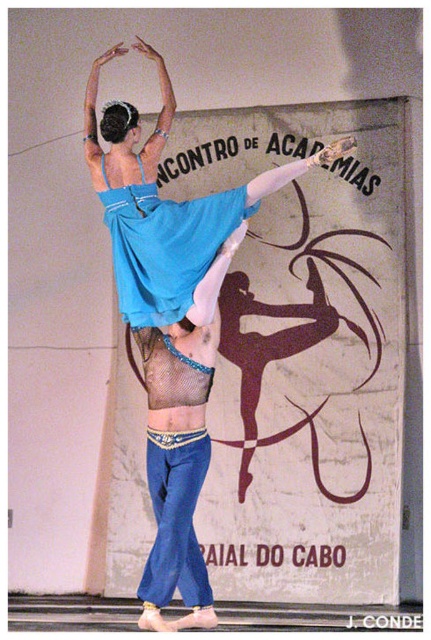
Based on the ballet performance scene described, where the two dancers are performing a lift with the female dancer in a flowing blue dress, can you identify the object located at the coordinates point (x=165, y=204)?

The point (x=165, y=204) corresponds to the matte blue fabric dress at center.

You are a stagehand observing the ballet performance. You notice two objects labeled as the matte blue fabric dress at center and the matte blue fabric at center. Which one is positioned higher in the scene?

The matte blue fabric dress at center is positioned higher than the matte blue fabric at center.